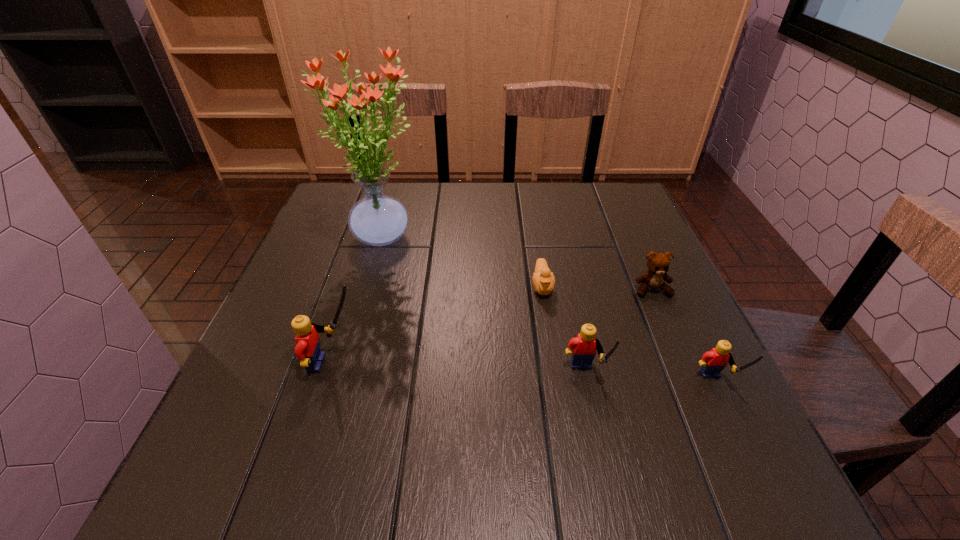
Locate which Lego is the second closest to the flower arrangement. Please provide its 2D coordinates. Your answer should be formatted as a tuple, i.e. [(x, y)], where the tuple contains the x and y coordinates of a point satisfying the conditions above.

[(584, 346)]

This screenshot has width=960, height=540. I want to click on Lego that stands as the third closest to the duckling, so click(x=307, y=340).